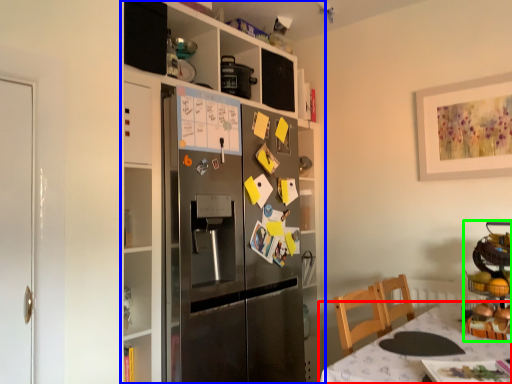
Question: Estimate the real-world distances between objects in this image. Which object is closer to table (highlighted by a red box), cabinetry (highlighted by a blue box) or appliance (highlighted by a green box)?

Choices:
 (A) cabinetry
 (B) appliance

Answer: (B)